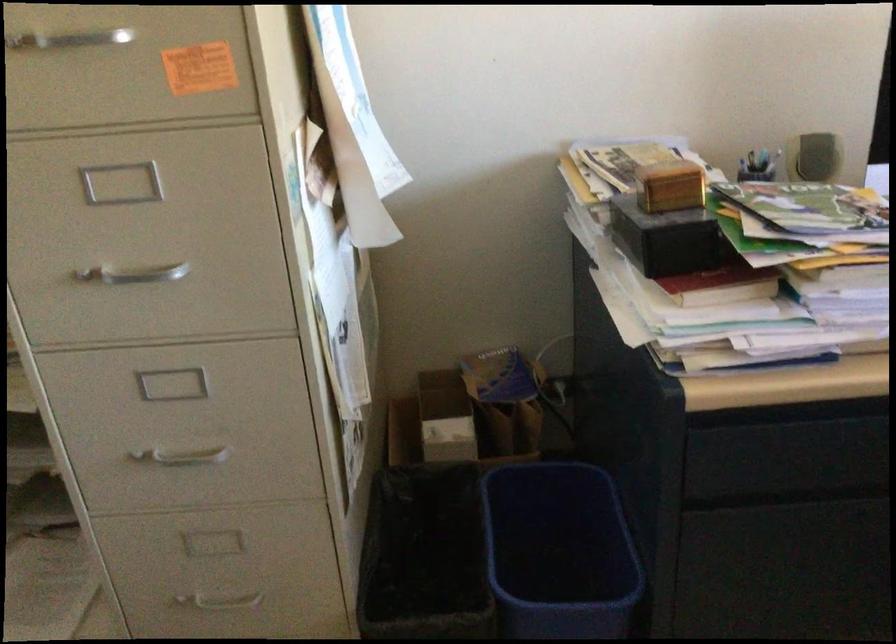
The location [558,552] corresponds to which object?

It corresponds to the blue plastic bin in the image.